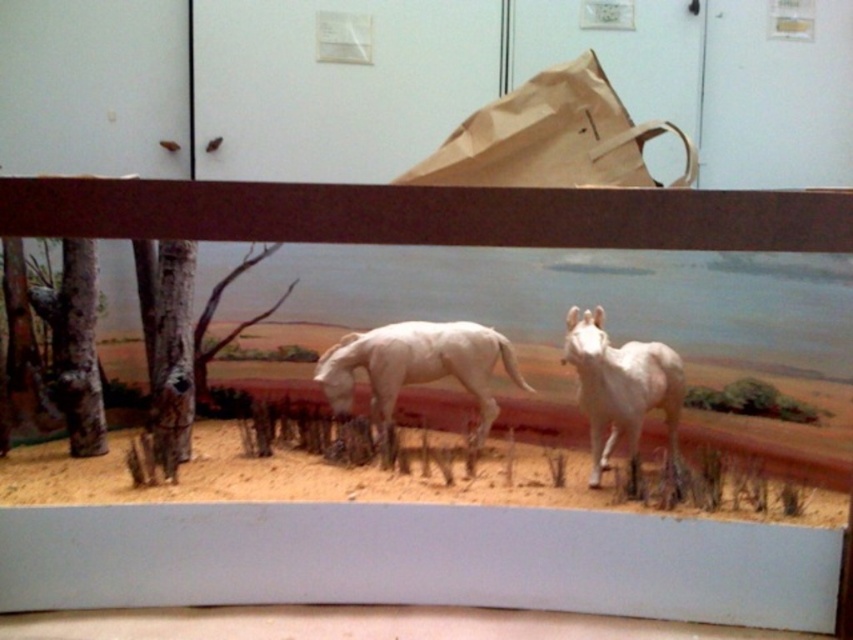
Can you confirm if brown paper bag at upper center is positioned above white matte horse at center?

Indeed, brown paper bag at upper center is positioned over white matte horse at center.

Between brown paper bag at upper center and white matte horse at center, which one appears on the right side from the viewer's perspective?

brown paper bag at upper center is more to the right.

Is point (578, 76) farther from viewer compared to point (471, 324)?

No.

You are a GUI agent. You are given a task and a screenshot of the screen. Output one action in this format:
    pyautogui.click(x=<x>, y=<y>)
    Task: Click on the brown paper bag at upper center
    
    Given the screenshot: What is the action you would take?
    pyautogui.click(x=550, y=138)

Does white matte horse at center have a lesser width compared to white glossy horse at center?

In fact, white matte horse at center might be wider than white glossy horse at center.

Between point (328, 390) and point (634, 419), which one is positioned in front?

Positioned in front is point (634, 419).

Is point (434, 376) less distant than point (660, 401)?

No.

Identify the location of white matte horse at center. This screenshot has height=640, width=853. (416, 365).

Does brown paper bag at upper center have a greater height compared to white glossy horse at center?

In fact, brown paper bag at upper center may be shorter than white glossy horse at center.

The width and height of the screenshot is (853, 640). In order to click on brown paper bag at upper center in this screenshot , I will do `click(550, 138)`.

Is point (467, 132) in front of point (578, 323)?

Yes.

Where is `brown paper bag at upper center`? brown paper bag at upper center is located at coordinates (550, 138).